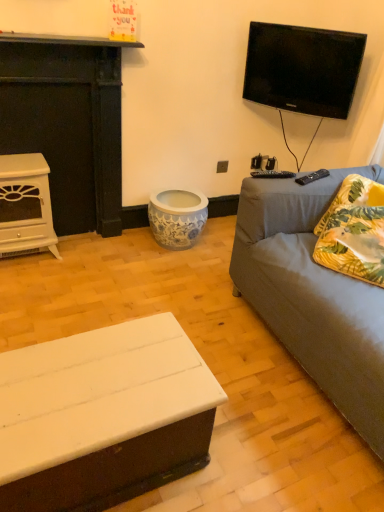
Question: Looking at their shapes, would you say white glossy fireplace at left, which is counted as the 2th fireplace, starting from the top, is wider or thinner than white matte fireplace at left, the 2th fireplace when ordered from bottom to top?

Choices:
 (A) thin
 (B) wide

Answer: (B)

Question: From the image's perspective, is white glossy fireplace at left, which is counted as the 2th fireplace, starting from the top, positioned above or below white matte fireplace at left, the 2th fireplace when ordered from bottom to top?

Choices:
 (A) above
 (B) below

Answer: (B)

Question: Based on their relative distances, which object is farther from the white glossy fireplace at left, which is counted as the 2th fireplace, starting from the top?

Choices:
 (A) black glossy tv at upper right
 (B) gray fabric couch at right
 (C) white matte fireplace at left, arranged as the 1th fireplace when viewed from the top
 (D) yellow floral fabric pillow at right
 (E) white matte coffee table at lower left

Answer: (D)

Question: Which is nearer to the white matte fireplace at left, the 2th fireplace when ordered from bottom to top?

Choices:
 (A) white matte coffee table at lower left
 (B) white glossy fireplace at left, which is counted as the 2th fireplace, starting from the top
 (C) gray fabric couch at right
 (D) black glossy tv at upper right
 (E) yellow floral fabric pillow at right

Answer: (B)